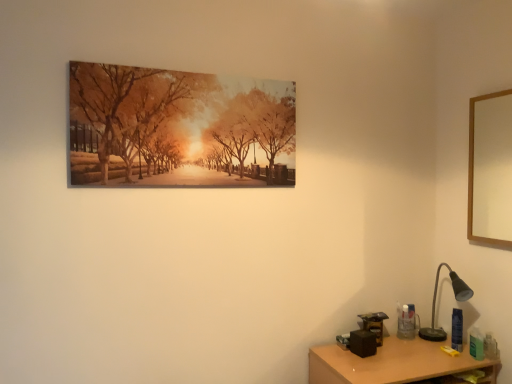
I want to click on blank space situated above matte canvas print at upper center, the second picture frame viewed from the right (from a real-world perspective), so click(x=185, y=64).